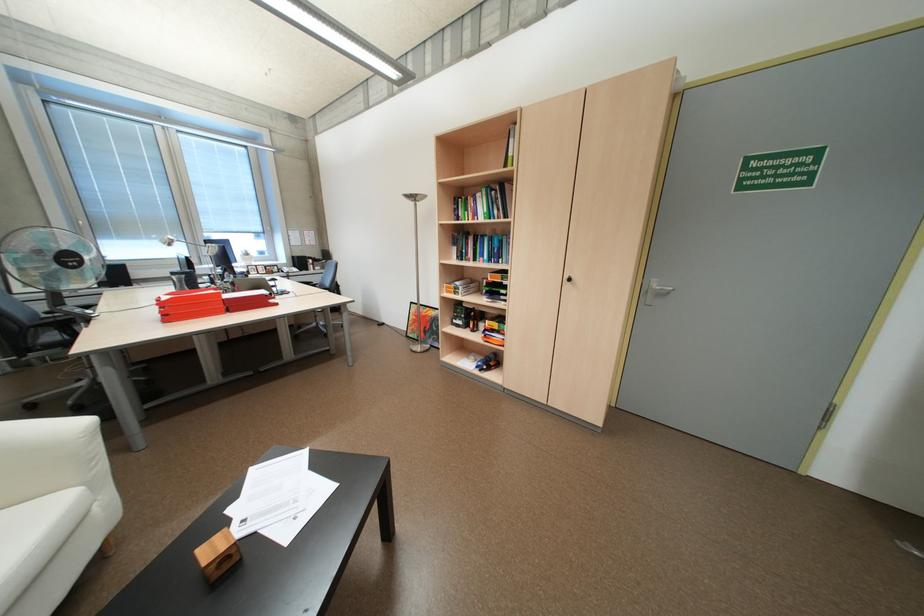
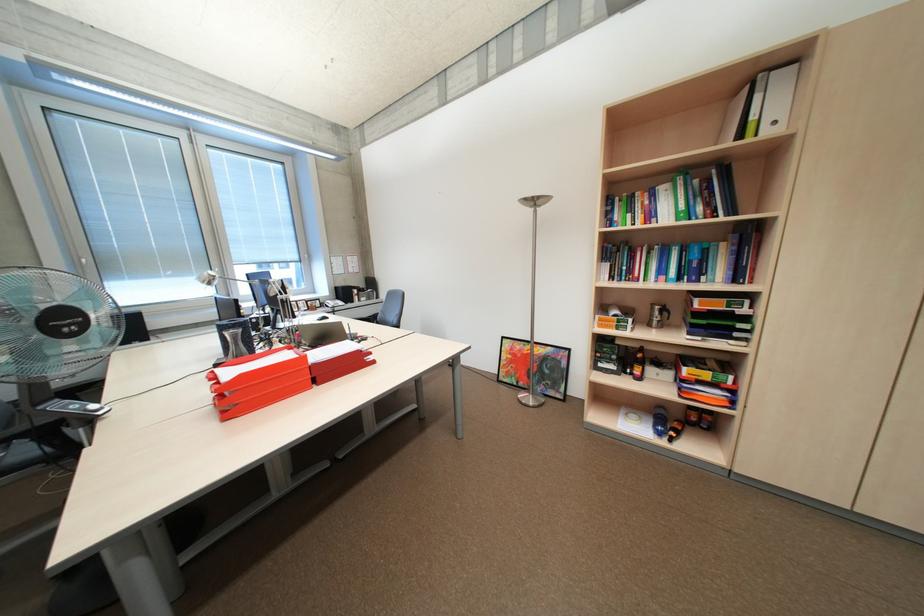
Locate, in the second image, the point that corresponds to [484,214] in the first image.

(661, 215)